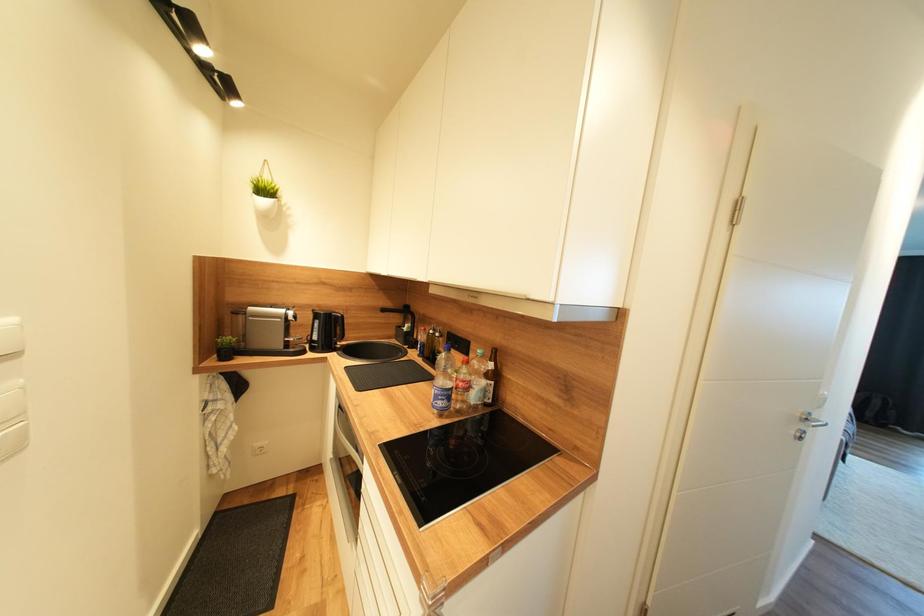
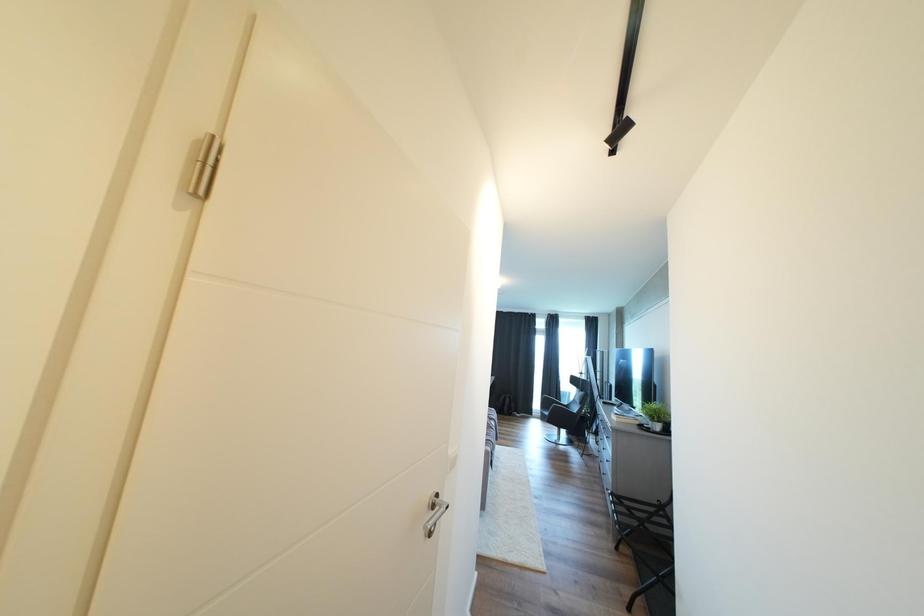
Question: The camera is either moving clockwise (left) or counter-clockwise (right) around the object. The first image is from the beginning of the video and the second image is from the end. Is the camera moving left or right when shooting the video?

Choices:
 (A) Left
 (B) Right

Answer: (A)